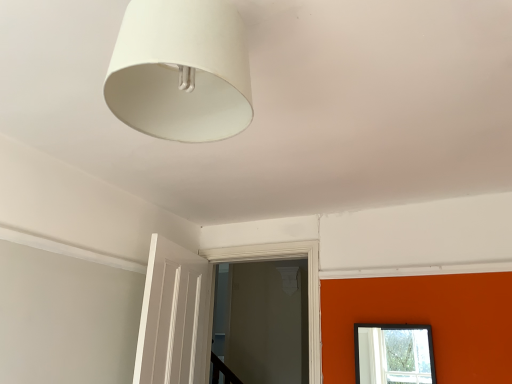
What do you see at coordinates (180, 71) in the screenshot? Image resolution: width=512 pixels, height=384 pixels. I see `white matte lampshade at upper center` at bounding box center [180, 71].

Find the location of a particular element. white matte lampshade at upper center is located at coordinates (180, 71).

Find the location of `white painted wood door frame at center`. white painted wood door frame at center is located at coordinates (308, 283).

The height and width of the screenshot is (384, 512). What do you see at coordinates (308, 283) in the screenshot? I see `white painted wood door frame at center` at bounding box center [308, 283].

Locate an element on the screen. The image size is (512, 384). white matte lampshade at upper center is located at coordinates (180, 71).

Would you say white painted wood door frame at center is to the left or to the right of white matte lampshade at upper center in the picture?

In the image, white painted wood door frame at center appears on the right side of white matte lampshade at upper center.

Based on the photo, which object is closer to the camera taking this photo, white painted wood door frame at center or white matte lampshade at upper center?

white matte lampshade at upper center is closer to the camera.

Is point (291, 247) closer or farther from the camera than point (189, 59)?

Point (291, 247).

Looking at this image, from the image's perspective, is white painted wood door frame at center located above white matte lampshade at upper center?

No.

From a real-world perspective, does white painted wood door frame at center sit lower than white matte lampshade at upper center?

Yes, from a real-world perspective, white painted wood door frame at center is below white matte lampshade at upper center.

Which object is wider, white painted wood door frame at center or white matte lampshade at upper center?

Wider between the two is white matte lampshade at upper center.

Can you confirm if white painted wood door frame at center is taller than white matte lampshade at upper center?

Indeed, white painted wood door frame at center has a greater height compared to white matte lampshade at upper center.

Considering the relative sizes of white painted wood door frame at center and white matte lampshade at upper center in the image provided, is white painted wood door frame at center smaller than white matte lampshade at upper center?

Incorrect, white painted wood door frame at center is not smaller in size than white matte lampshade at upper center.

Is white painted wood door frame at center positioned beyond the bounds of white matte lampshade at upper center?

Yes, white painted wood door frame at center is not within white matte lampshade at upper center.

Is white painted wood door frame at center not close to white matte lampshade at upper center?

Yes, white painted wood door frame at center and white matte lampshade at upper center are quite far apart.

Could you tell me if white painted wood door frame at center is turned towards white matte lampshade at upper center?

Yes, white painted wood door frame at center is aimed at white matte lampshade at upper center.

Can you tell me how much white painted wood door frame at center and white matte lampshade at upper center differ in facing direction?

They differ by 88.4 degrees in their facing directions.

In order to click on window frame lying below the white matte lampshade at upper center (from the image's perspective) in this screenshot , I will do `click(308, 283)`.

Between white matte lampshade at upper center and white painted wood door frame at center, which one appears on the left side from the viewer's perspective?

white matte lampshade at upper center.

Considering the relative positions of white matte lampshade at upper center and white painted wood door frame at center in the image provided, is white matte lampshade at upper center behind white painted wood door frame at center?

No, it is not.

Does point (114, 66) lie in front of point (316, 250)?

Yes.

From the image's perspective, who appears lower, white matte lampshade at upper center or white painted wood door frame at center?

white painted wood door frame at center appears lower in the image.

From a real-world perspective, relative to white painted wood door frame at center, is white matte lampshade at upper center vertically above or below?

white matte lampshade at upper center is situated higher than white painted wood door frame at center in the real world.

Is white matte lampshade at upper center thinner than white painted wood door frame at center?

No.

Is white matte lampshade at upper center taller or shorter than white painted wood door frame at center?

Considering their sizes, white matte lampshade at upper center has less height than white painted wood door frame at center.

Which of these two, white matte lampshade at upper center or white painted wood door frame at center, is smaller?

white matte lampshade at upper center.

Is white matte lampshade at upper center located outside white painted wood door frame at center?

white matte lampshade at upper center is positioned outside white painted wood door frame at center.

Is white matte lampshade at upper center positioned far away from white painted wood door frame at center?

Yes.

Is white matte lampshade at upper center facing towards white painted wood door frame at center?

No, white matte lampshade at upper center is not facing towards white painted wood door frame at center.

How much distance is there between white matte lampshade at upper center and white painted wood door frame at center?

They are 6.39 feet apart.

This screenshot has height=384, width=512. Identify the location of window frame located underneath the white matte lampshade at upper center (from a real-world perspective). (308, 283).

The width and height of the screenshot is (512, 384). Find the location of `window frame below the white matte lampshade at upper center (from the image's perspective)`. window frame below the white matte lampshade at upper center (from the image's perspective) is located at coordinates (308, 283).

Where is `window frame on the right of white matte lampshade at upper center`? The width and height of the screenshot is (512, 384). window frame on the right of white matte lampshade at upper center is located at coordinates (308, 283).